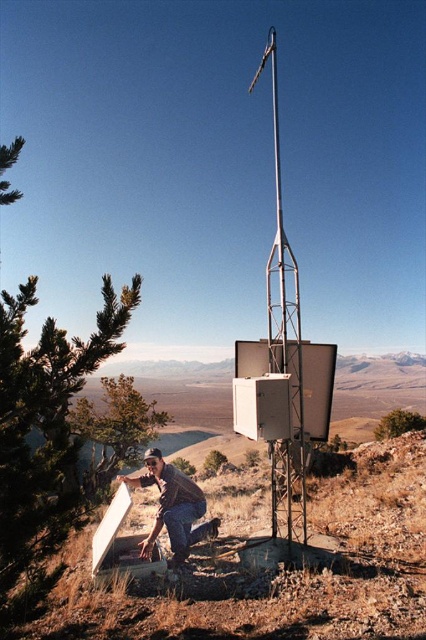
You are standing at the camera position looking at the scene. There are two points marked in the image, point 1 at coordinates point (163, 621) and point 2 at coordinates point (275, 368). Which point is closer to you?

Point (163, 621) is closer to the camera than point (275, 368).

You are a geologist analyzing the image. You need to locate the brown dirt at lower left. What are its coordinates?

The brown dirt at lower left is located at coordinates point (273,566).

You are a hiker who wants to take a selfie with the metallic pole at center and the brown leather jacket at lower center. Can you stand in front of both objects so that both are fully visible in the photo?

The metallic pole at center is taller than the brown leather jacket at lower center. To ensure both are fully visible in the selfie, you should position yourself so that the shorter brown leather jacket at lower center is closer to the camera and the taller metallic pole at center is further back, allowing both to fit within the frame.